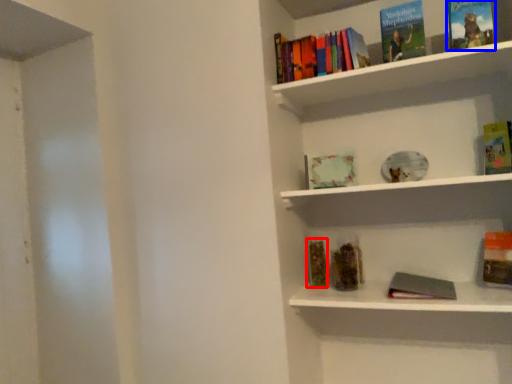
Question: Which object appears farthest to the camera in this image, book (highlighted by a red box) or book (highlighted by a blue box)?

Choices:
 (A) book
 (B) book

Answer: (A)